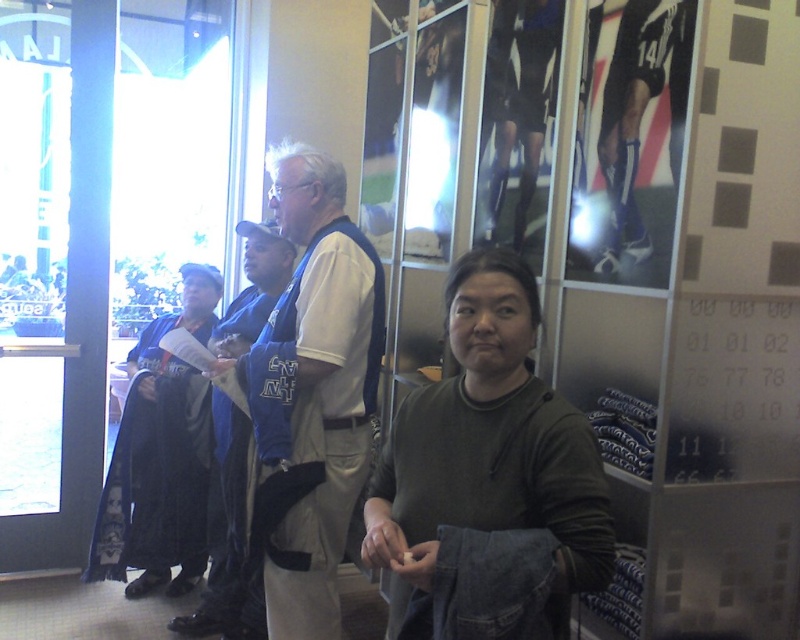
Question: Which point appears farthest from the camera in this image?

Choices:
 (A) (188, 308)
 (B) (596, 460)

Answer: (A)

Question: Does dark green sweater at center appear under black fabric robe at left?

Choices:
 (A) yes
 (B) no

Answer: (A)

Question: Is light beige fabric shirt at center behind blue jersey at left?

Choices:
 (A) no
 (B) yes

Answer: (A)

Question: Is light beige fabric shirt at center behind blue jersey at left?

Choices:
 (A) yes
 (B) no

Answer: (B)

Question: Which of the following is the farthest from the observer?

Choices:
 (A) (356, 408)
 (B) (490, 490)
 (C) (284, 262)
 (D) (150, 582)

Answer: (D)

Question: Considering the real-world distances, which object is closest to the light beige fabric shirt at center?

Choices:
 (A) blue jersey at left
 (B) black fabric robe at left

Answer: (A)